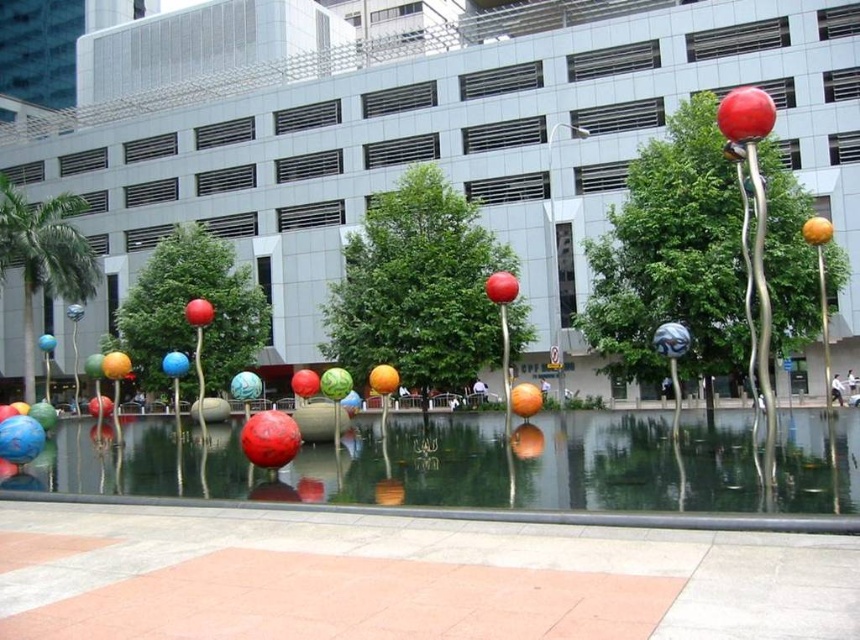
Question: Is glossy metallic water at center smaller than shiny metallic sphere at center?

Choices:
 (A) yes
 (B) no

Answer: (B)

Question: Which object is farther from the camera taking this photo?

Choices:
 (A) blue glossy ball at center
 (B) shiny metallic sphere at upper right
 (C) glossy metallic water at center

Answer: (A)

Question: Can you confirm if glossy metallic water at center is positioned to the right of blue glossy ball at center?

Choices:
 (A) yes
 (B) no

Answer: (A)

Question: Based on their relative distances, which object is nearer to the glossy metallic water at center?

Choices:
 (A) shiny metallic sphere at center
 (B) shiny metallic sphere at upper right

Answer: (A)

Question: Which of the following is the closest to the observer?

Choices:
 (A) shiny metallic sphere at center
 (B) blue glossy ball at center
 (C) glossy metallic water at center

Answer: (C)

Question: Can you confirm if glossy metallic water at center is positioned to the right of shiny metallic sphere at upper right?

Choices:
 (A) no
 (B) yes

Answer: (A)